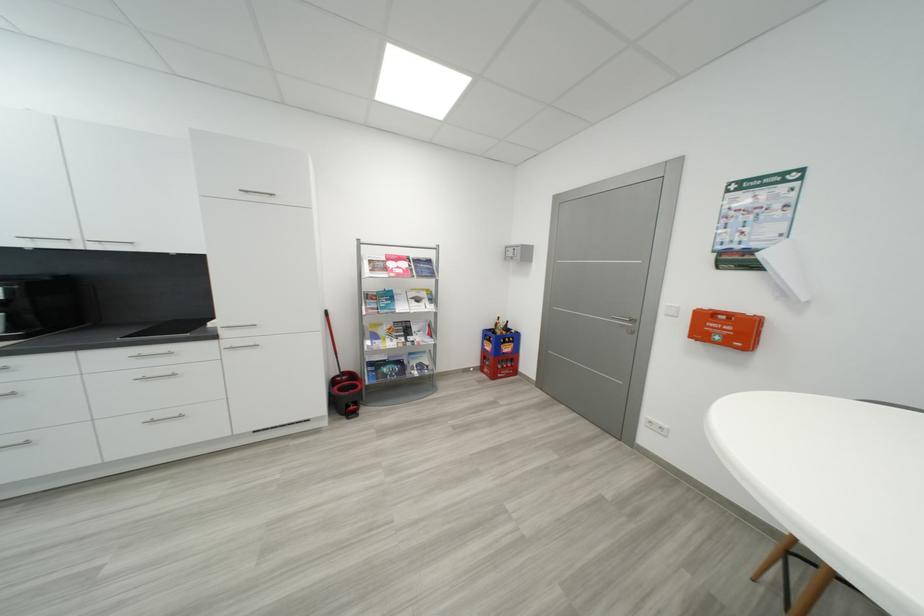
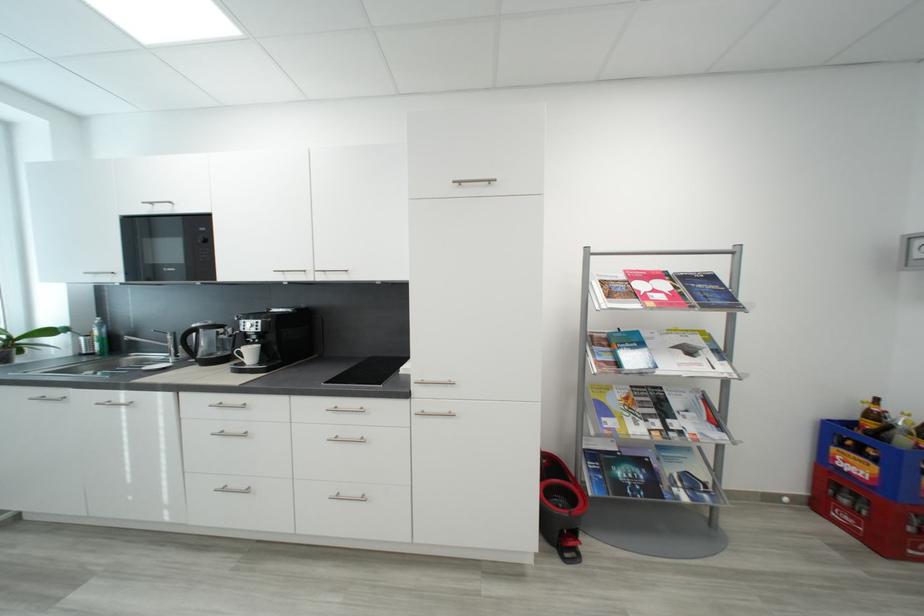
In the second image, find the point that corresponds to pixel 421 330 in the first image.

(684, 406)